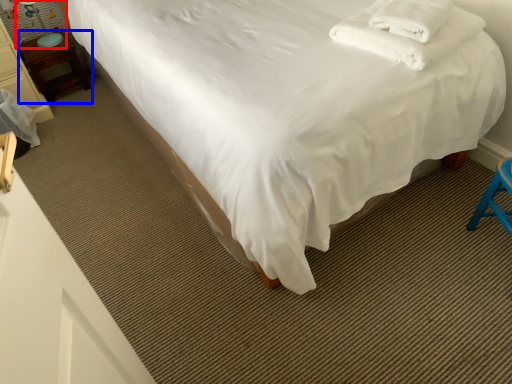
Question: Which object is further to the camera taking this photo, table lamp (highlighted by a red box) or nightstand (highlighted by a blue box)?

Choices:
 (A) table lamp
 (B) nightstand

Answer: (B)